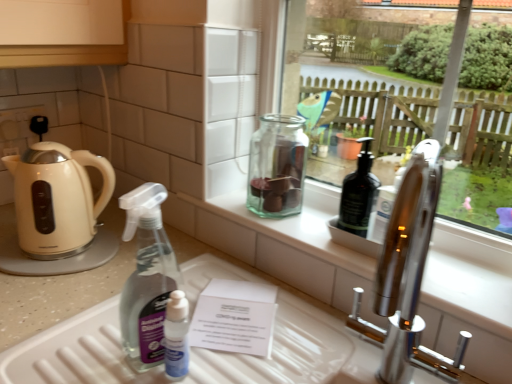
Locate an element on the screen. free space above white plastic tray at lower center (from a real-world perspective) is located at coordinates (207, 337).